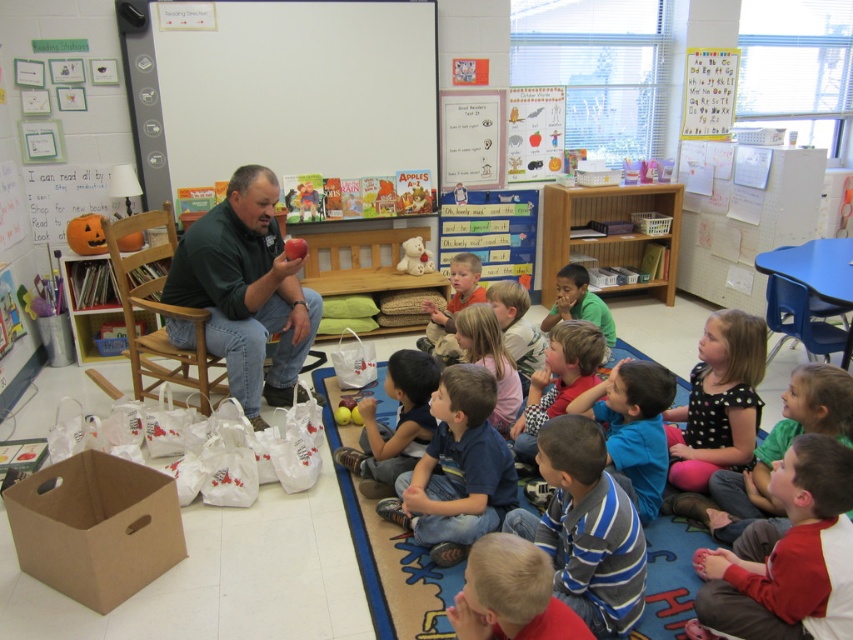
Between blue denim jeans at lower center and light brown hair at center, which one is positioned higher?

light brown hair at center is higher up.

Does blue denim jeans at lower center have a greater height compared to light brown hair at center?

Correct, blue denim jeans at lower center is much taller as light brown hair at center.

Between point (405, 483) and point (583, 372), which one is positioned behind?

The point (583, 372) is behind.

Identify the location of blue denim jeans at lower center. (456, 470).

Can you confirm if red cotton shirt at lower right is smaller than light pink fabric dress at center?

Indeed, red cotton shirt at lower right has a smaller size compared to light pink fabric dress at center.

Can you confirm if red cotton shirt at lower right is positioned to the right of light pink fabric dress at center?

Indeed, red cotton shirt at lower right is positioned on the right side of light pink fabric dress at center.

Does point (833, 444) come farther from viewer compared to point (490, 339)?

No, it is not.

At what (x,y) coordinates should I click in order to perform the action: click on red cotton shirt at lower right. Please return your answer as a coordinate pair (x, y). The width and height of the screenshot is (853, 640). Looking at the image, I should click on (787, 556).

Can you confirm if striped cotton shirt at lower center is wider than green matte shirt at center?

Indeed, striped cotton shirt at lower center has a greater width compared to green matte shirt at center.

Is point (576, 518) closer to viewer compared to point (564, 294)?

Yes, it is.

I want to click on striped cotton shirt at lower center, so click(x=585, y=528).